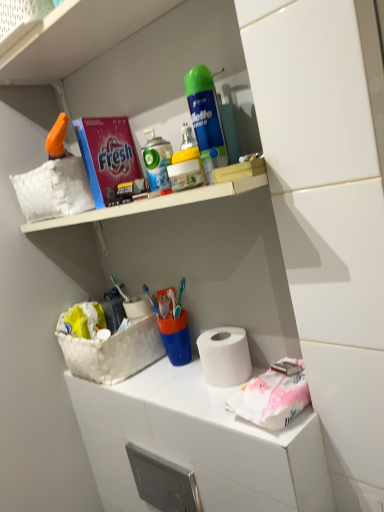
Where is `vacant region above white matte toilet paper at lower center (from a real-world perspective)`? The height and width of the screenshot is (512, 384). vacant region above white matte toilet paper at lower center (from a real-world perspective) is located at coordinates (176, 377).